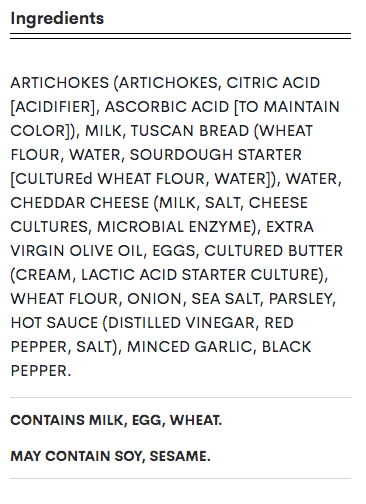
Image resolution: width=366 pixels, height=504 pixels. What are the coordinates of `brackets` in the screenshot? It's located at (267, 178), (12, 179), (11, 106), (93, 106), (237, 107), (67, 129).